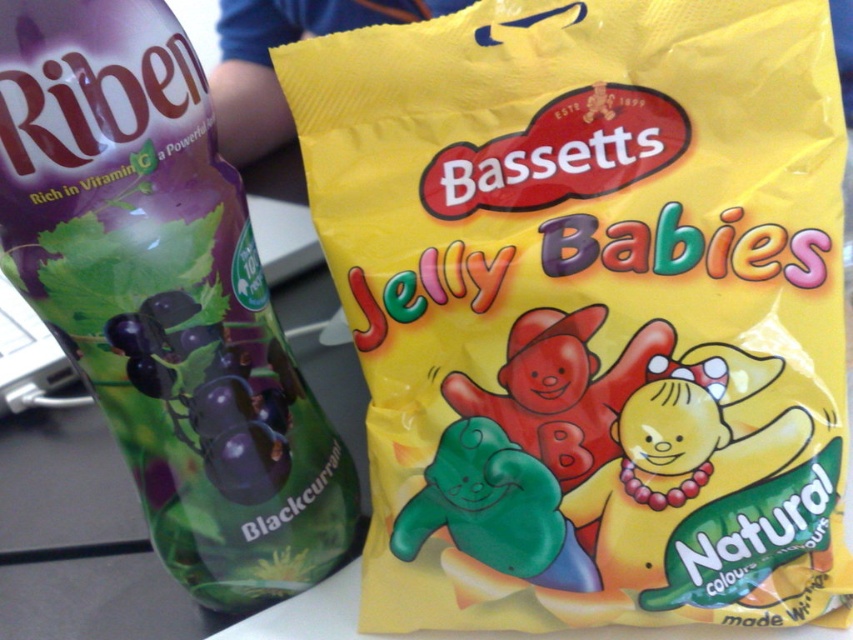
You are a nutritionist organizing a healthy snack display. You have a yellow matte plastic bag of jelly babies at right and a translucent purple bottle at left. The recommended minimum distance between snacks to ensure visibility is 6 inches. Can both snacks be placed as per this requirement?

The yellow matte plastic bag of jelly babies at right and translucent purple bottle at left are 6.10 inches apart from each other, which meets the 6 inch requirement. Therefore, they can be placed as per the requirement.

You are organizing a picnic basket and have space for either the yellow matte plastic bag of jelly babies at right or the translucent purple bottle at left. Based on their widths, which item would fit better in a narrow compartment?

The translucent purple bottle at left would fit better in a narrow compartment since the yellow matte plastic bag of jelly babies at right might be wider than the bottle.

You are a delivery person who needs to place a small package between the yellow matte plastic bag of jelly babies at right and the green rubber bear at center. The package is 5 inches long. Can you fit it in the space between them?

The space between the yellow matte plastic bag of jelly babies at right and the green rubber bear at center is 4.77 inches. Since the package is 5 inches long, it will not fit in the available space.